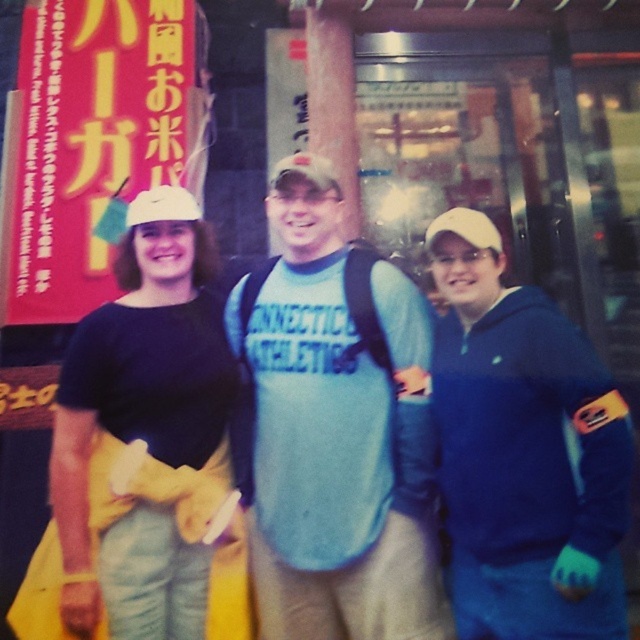
Question: Does matte black shirt at center appear over white matte baseball cap at center?

Choices:
 (A) no
 (B) yes

Answer: (A)

Question: From the image, what is the correct spatial relationship of blue fleece jacket at center in relation to white matte baseball cap at center?

Choices:
 (A) below
 (B) above

Answer: (A)

Question: Which of the following is the farthest from the observer?

Choices:
 (A) matte black shirt at center
 (B) white matte baseball cap at center
 (C) blue fleece jacket at center
 (D) blue cotton t-shirt at center

Answer: (B)

Question: Observing the image, what is the correct spatial positioning of matte black shirt at center in reference to white matte baseball cap at center?

Choices:
 (A) left
 (B) right

Answer: (A)

Question: Which point appears farthest from the camera in this image?

Choices:
 (A) (500, 387)
 (B) (179, 189)

Answer: (B)

Question: Based on their relative distances, which object is farther from the blue fleece jacket at center?

Choices:
 (A) white matte baseball cap at center
 (B) matte black shirt at center
 (C) blue cotton t-shirt at center

Answer: (A)